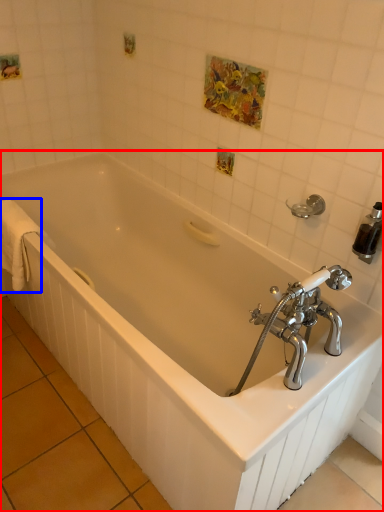
Question: Which of the following is the farthest to the observer, bathtub (highlighted by a red box) or bath towel (highlighted by a blue box)?

Choices:
 (A) bathtub
 (B) bath towel

Answer: (B)